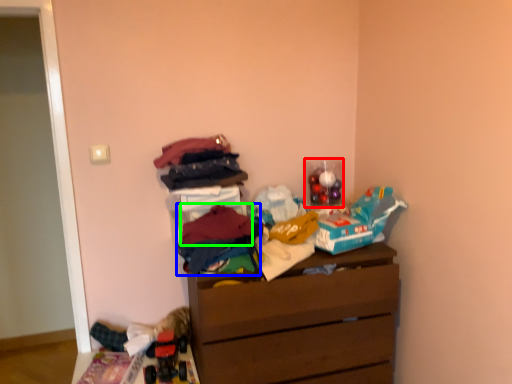
Question: Which object is the closest to the toy (highlighted by a red box)? Choose among these: clothing (highlighted by a blue box) or clothing (highlighted by a green box).

Choices:
 (A) clothing
 (B) clothing

Answer: (A)